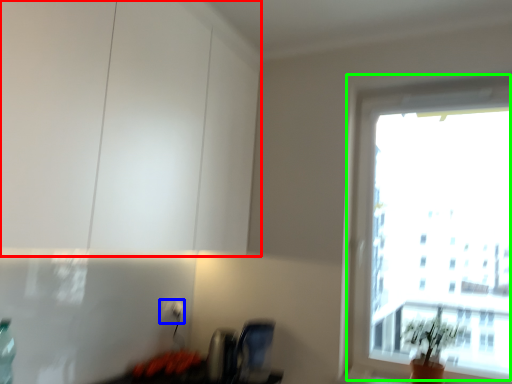
Question: Which object is positioned closest to cabinetry (highlighted by a red box)? Select from electric outlet (highlighted by a blue box) and window (highlighted by a green box).

Choices:
 (A) electric outlet
 (B) window

Answer: (A)